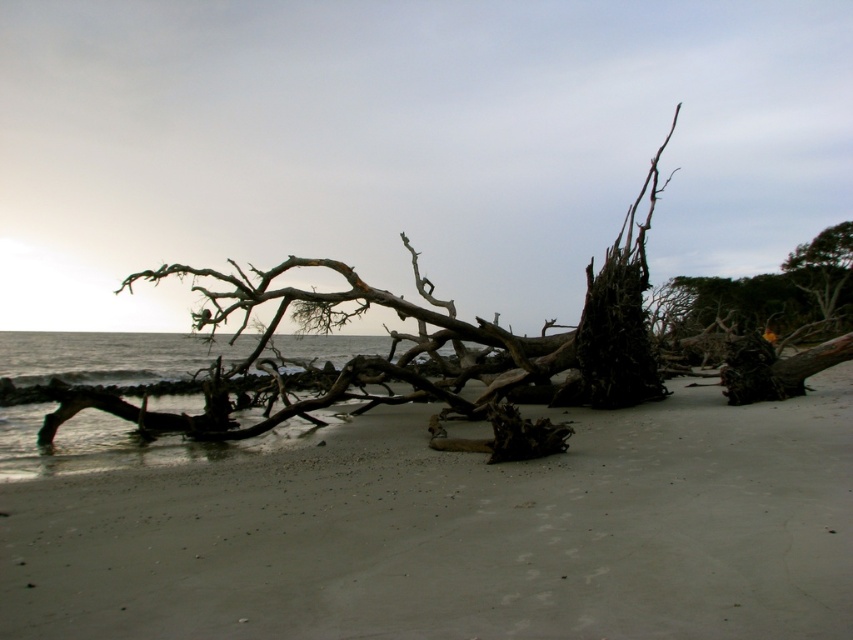
How much distance is there between gray sand at center and green leafy tree at upper right?

34.78 meters

Is point (570, 609) farther from viewer compared to point (844, 237)?

No, it is not.

The width and height of the screenshot is (853, 640). Find the location of `gray sand at center`. gray sand at center is located at coordinates (459, 532).